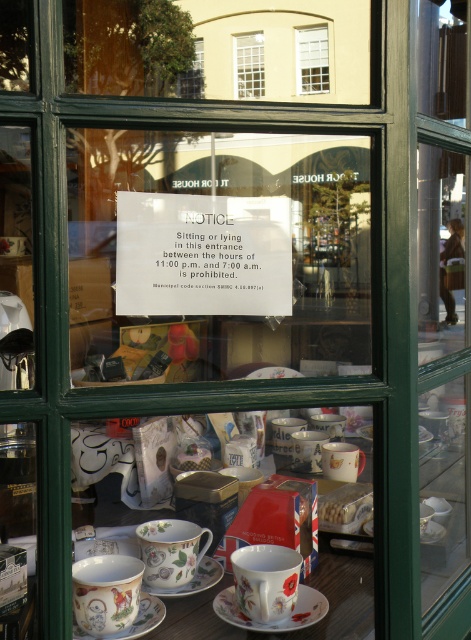
You are a delivery person trying to place a floral porcelain teacup at lower center on a shelf next to the white wooden window at upper center. Considering their sizes, will the teacup fit on the same shelf as the window?

The floral porcelain teacup at lower center is wider than the white wooden window at upper center, so it might not fit on the same shelf depending on the shelf space available. Check the shelf dimensions before placing it.

You are standing in front of the shop window and want to touch the notice on the window. The notice is at point (236, 560). If your hand can reach up to 1 meter, can you reach the notice?

The distance between point (236, 560) and the camera is 1.10 meters. Since your hand can only reach up to 1 meter, you cannot reach the notice.

You are a customer entering the shop and see the floral porcelain teacup at lower center and the white glass window at upper center. Which object is positioned to the right of the other?

The floral porcelain teacup at lower center is to the right of the white glass window at upper center.